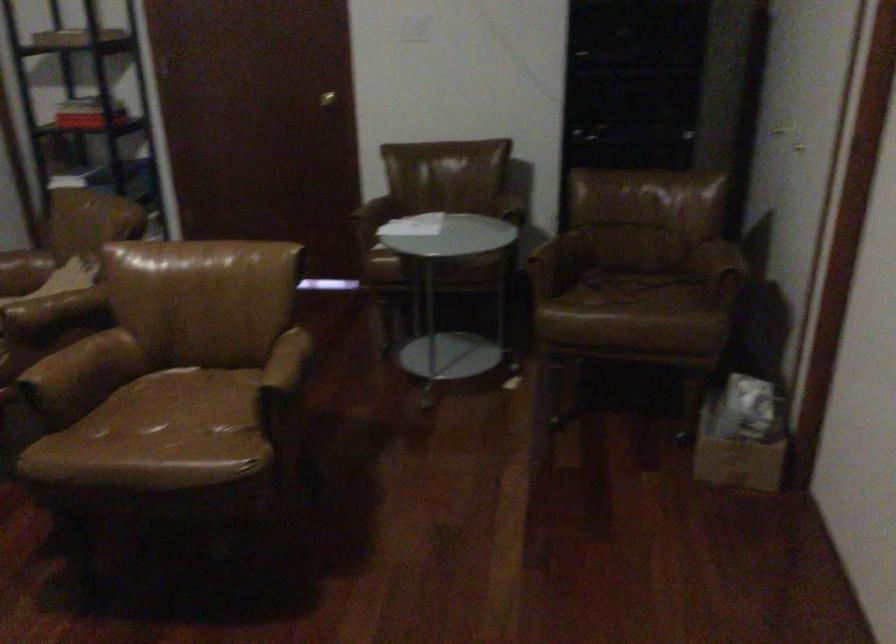
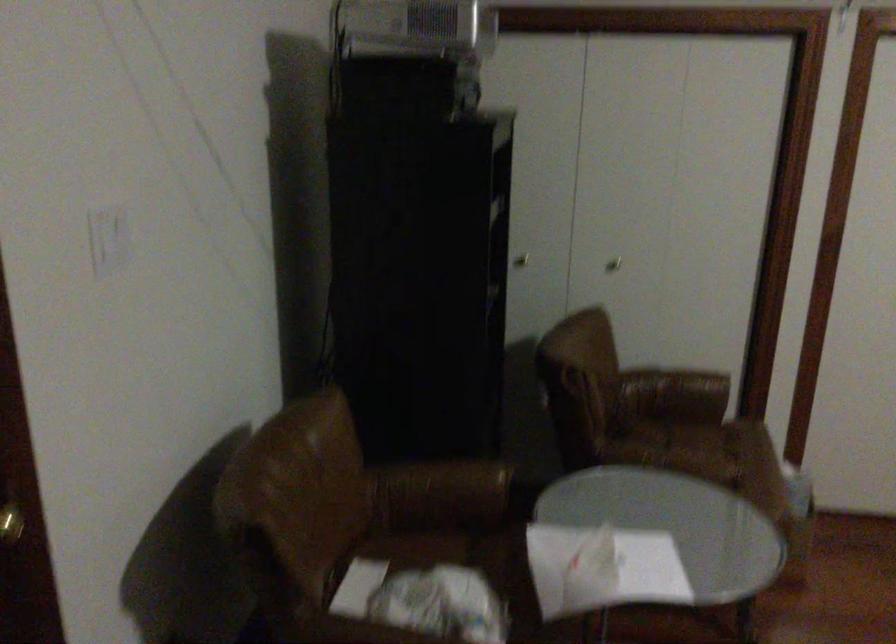
Locate, in the second image, the point that corresponds to (x=673, y=310) in the first image.

(718, 442)